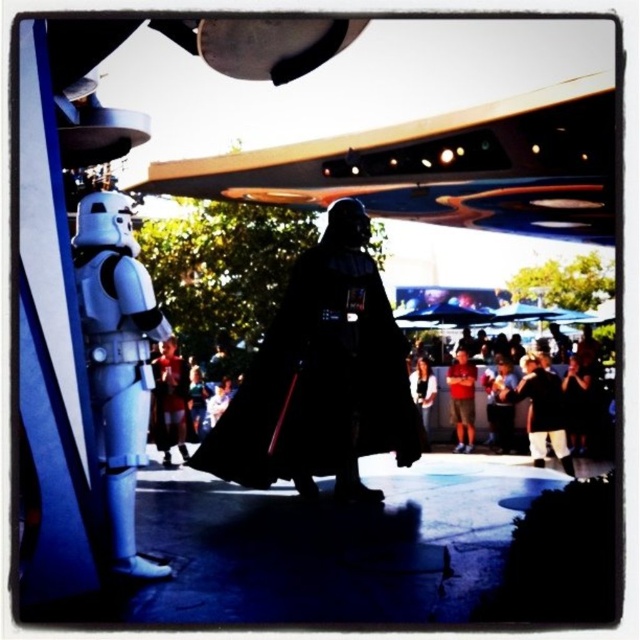
Question: Estimate the real-world distances between objects in this image. Which object is closer to the black matte cloak at center?

Choices:
 (A) red cotton shirt at center
 (B) white matte stormtrooper at center

Answer: (A)

Question: Is black matte cloak at center thinner than white matte stormtrooper at center?

Choices:
 (A) no
 (B) yes

Answer: (A)

Question: Which point is closer to the camera taking this photo?

Choices:
 (A) (282, 317)
 (B) (182, 381)

Answer: (A)

Question: Considering the relative positions of orange shorts at center and white matte stormtrooper at center in the image provided, where is orange shorts at center located with respect to white matte stormtrooper at center?

Choices:
 (A) above
 (B) below

Answer: (A)

Question: Which point appears farthest from the camera in this image?

Choices:
 (A) (144, 557)
 (B) (300, 326)
 (C) (420, 417)
 (D) (184, 406)

Answer: (C)

Question: Does white plastic stormtrooper at left appear on the right side of red cotton shirt at center?

Choices:
 (A) yes
 (B) no

Answer: (B)